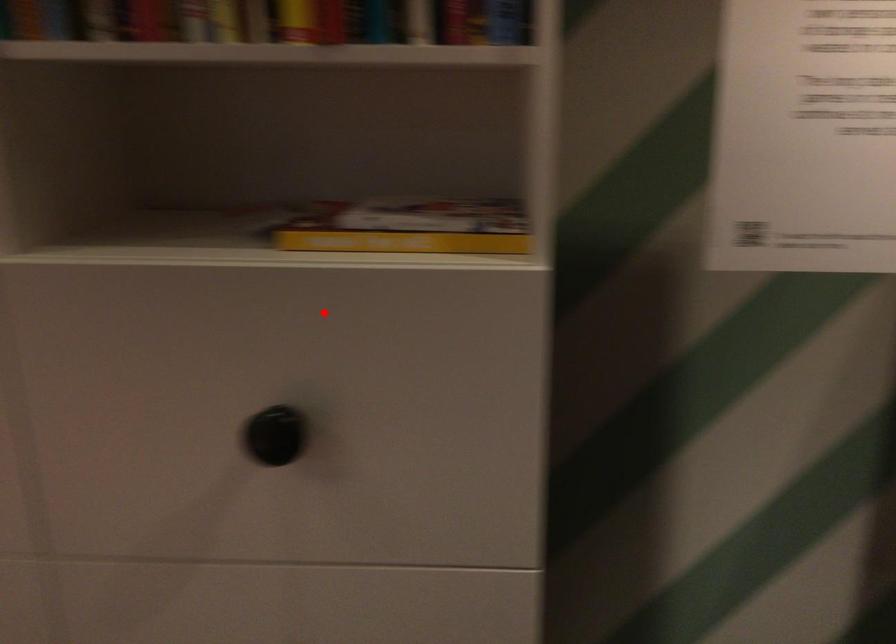
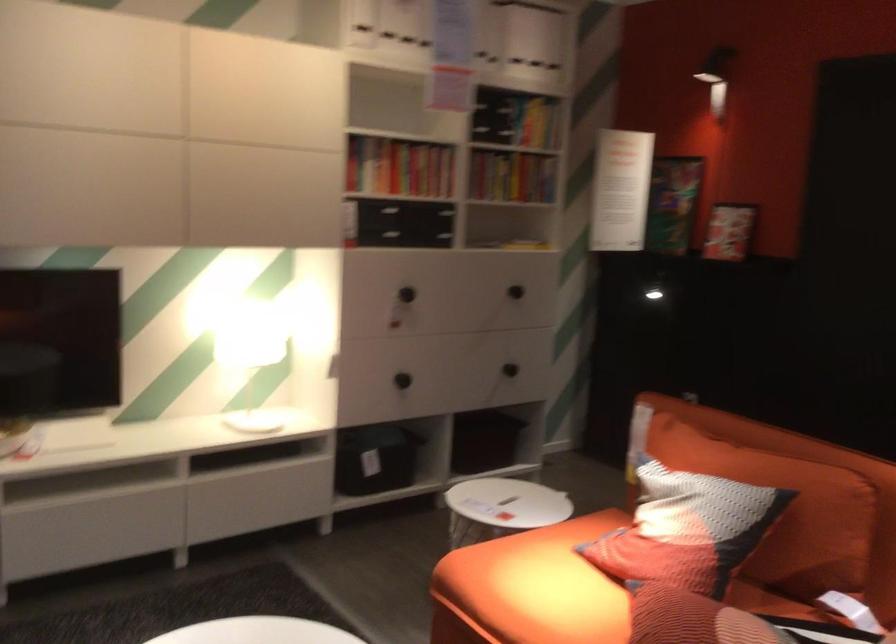
Locate, in the second image, the point that corresponds to the highlighted location in the first image.

(524, 245)